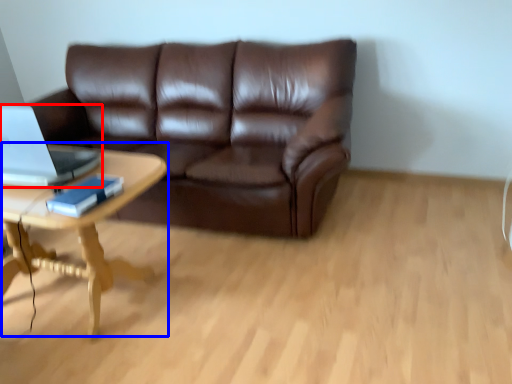
Question: Which of the following is the farthest to the observer, laptop (highlighted by a red box) or coffee table (highlighted by a blue box)?

Choices:
 (A) laptop
 (B) coffee table

Answer: (A)